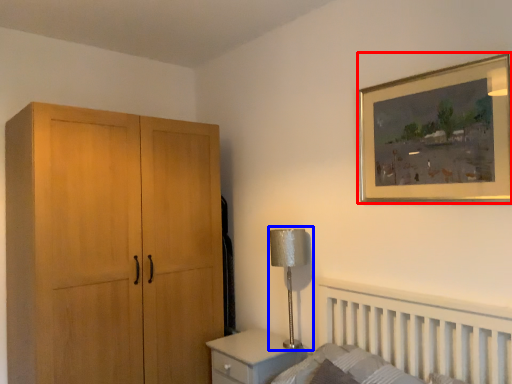
Question: Which object is further to the camera taking this photo, picture frame (highlighted by a red box) or table lamp (highlighted by a blue box)?

Choices:
 (A) picture frame
 (B) table lamp

Answer: (B)